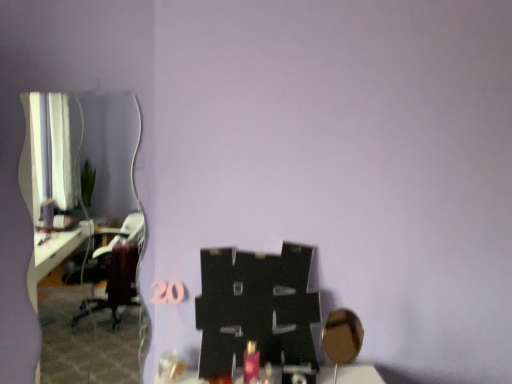
This screenshot has width=512, height=384. Describe the element at coordinates (80, 149) in the screenshot. I see `clear glass mirror at left` at that location.

Measure the distance between clear glass mirror at left and camera.

The depth of clear glass mirror at left is 9.44 feet.

The height and width of the screenshot is (384, 512). Find the location of `clear glass mirror at left`. clear glass mirror at left is located at coordinates (80, 149).

Identify the location of clear glass mirror at left. This screenshot has width=512, height=384. (80, 149).